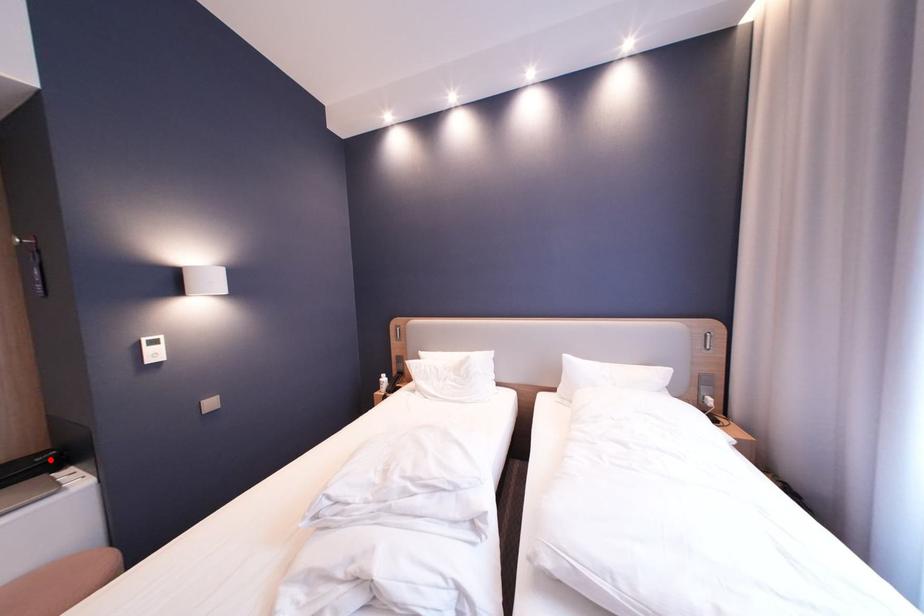
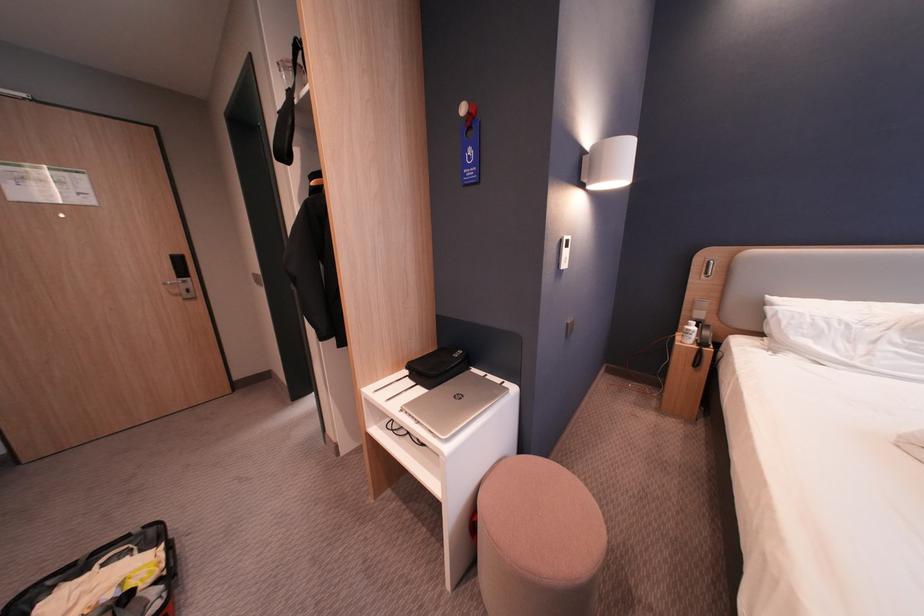
Where in the second image is the point corresponding to the highlighted location from the first image?

(467, 357)